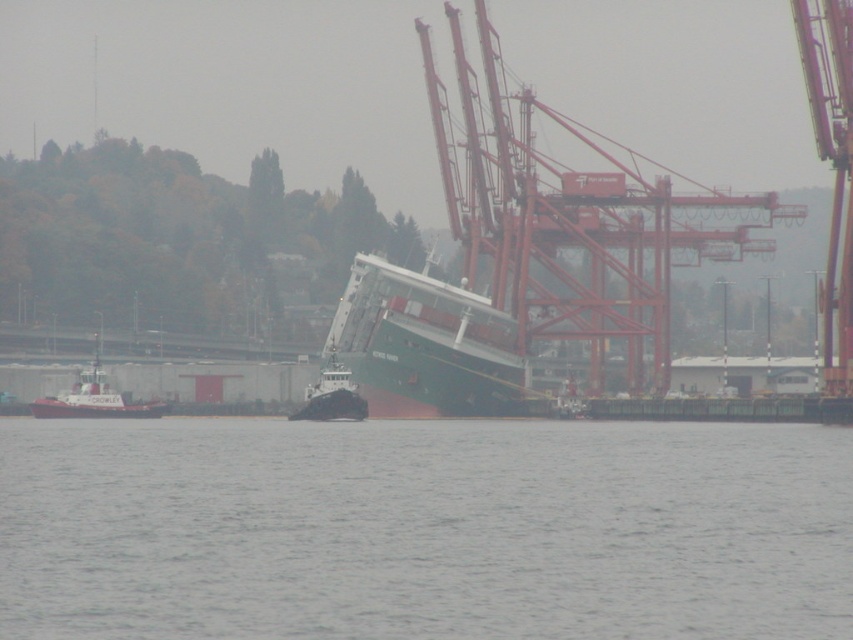
Between metallic red crane at center and brushed metal tugboat at left, which one is positioned lower?

Positioned lower is brushed metal tugboat at left.

Identify the location of metallic red crane at center. (573, 221).

You are a GUI agent. You are given a task and a screenshot of the screen. Output one action in this format:
    pyautogui.click(x=<x>, y=<y>)
    Task: Click on the metallic red crane at center
    
    Given the screenshot: What is the action you would take?
    pyautogui.click(x=573, y=221)

Can you confirm if metallic red crane at center is positioned below black rubber tugboat at center?

Actually, metallic red crane at center is above black rubber tugboat at center.

Between metallic red crane at center and black rubber tugboat at center, which one is positioned lower?

black rubber tugboat at center

Who is more distant from viewer, (546, 196) or (329, 403)?

Point (546, 196)

The width and height of the screenshot is (853, 640). I want to click on metallic red crane at center, so click(x=573, y=221).

Who is more distant from viewer, (393, 332) or (335, 371)?

Point (393, 332)

Image resolution: width=853 pixels, height=640 pixels. What do you see at coordinates (425, 346) in the screenshot?
I see `green matte container ship at center` at bounding box center [425, 346].

Where is `green matte container ship at center`? green matte container ship at center is located at coordinates (425, 346).

At what (x,y) coordinates should I click in order to perform the action: click on green matte container ship at center. Please return your answer as a coordinate pair (x, y). Looking at the image, I should click on (425, 346).